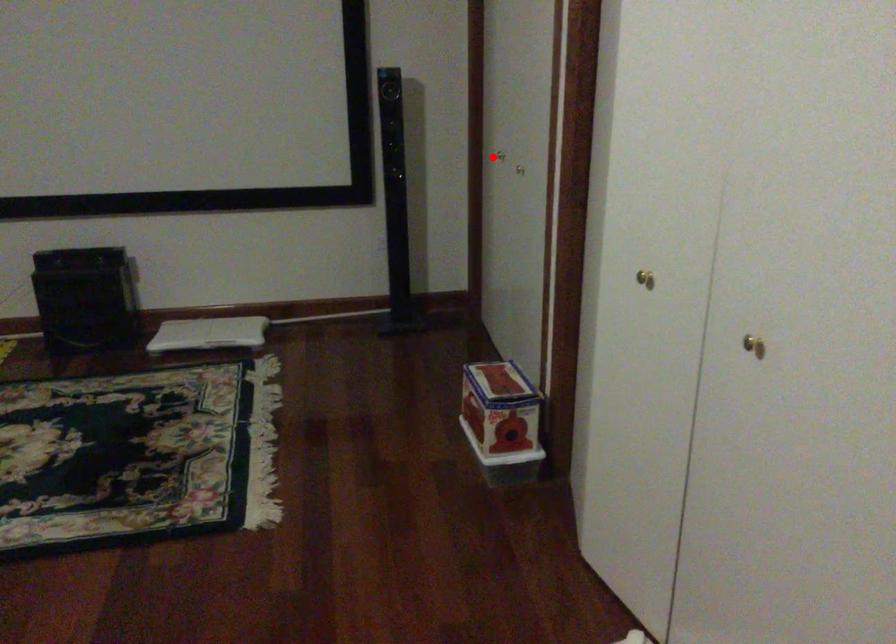
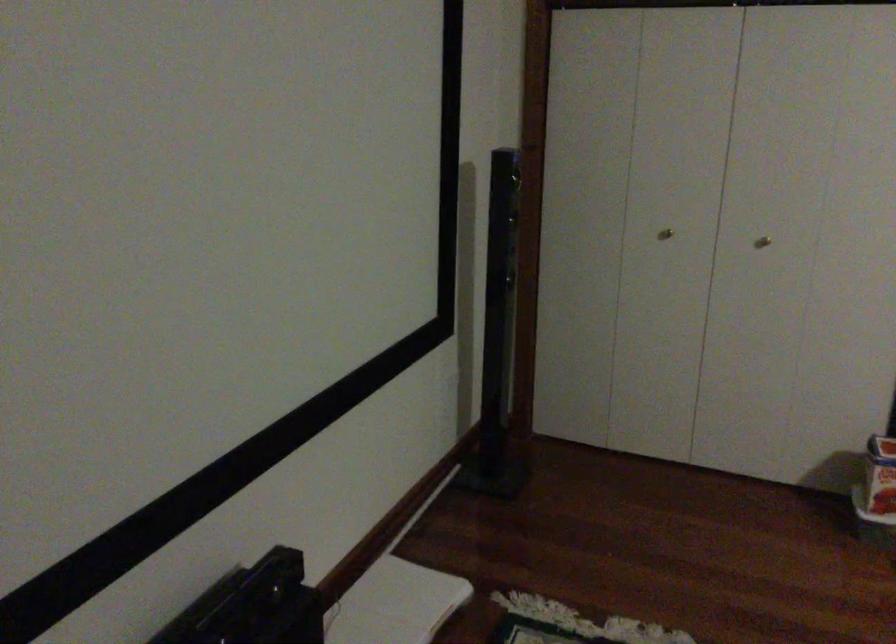
Question: I am providing you with two images of the same scene from different viewpoints. Given a red point in image1, look at the same physical point in image2. Is it:

Choices:
 (A) Closer to the viewpoint
 (B) Farther from the viewpoint

Answer: (A)